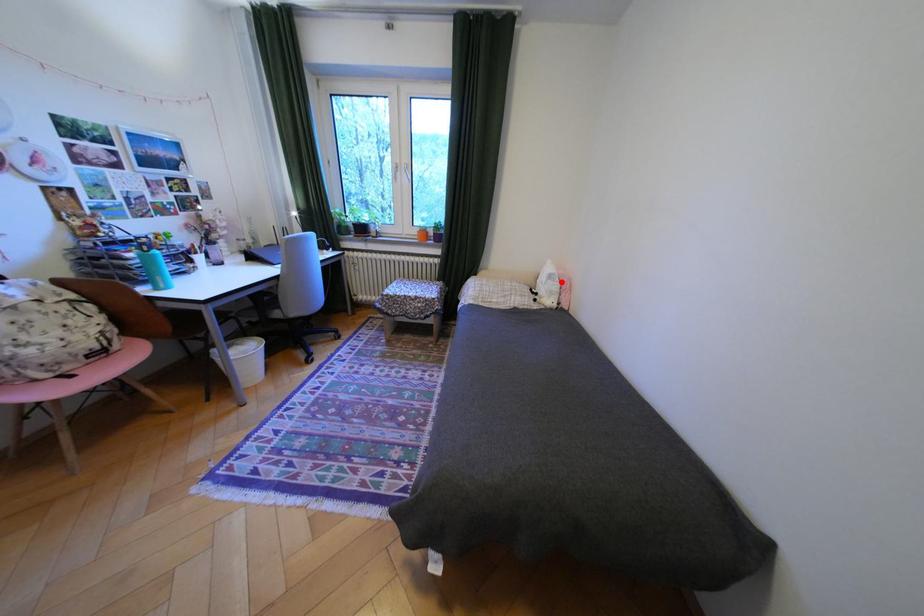
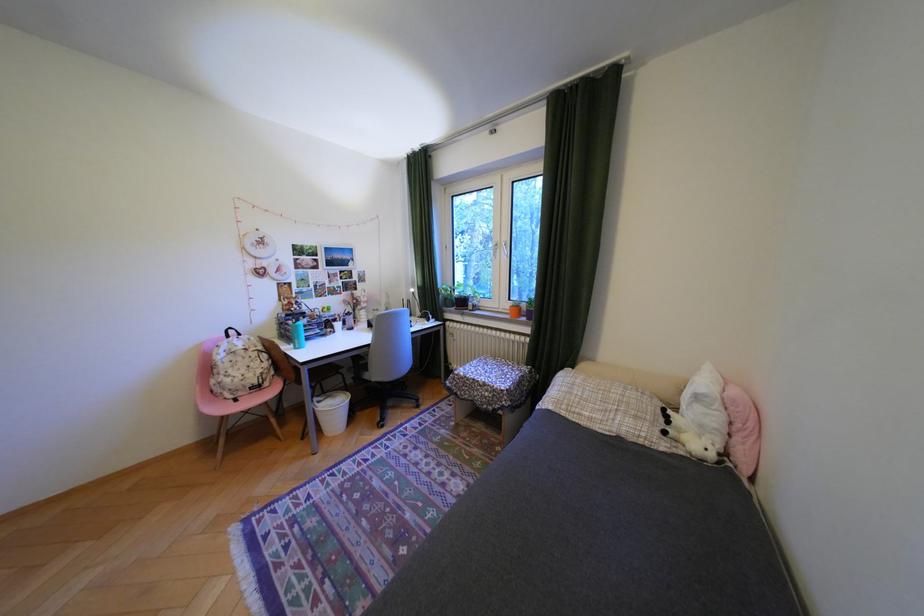
Question: I am providing you with two images of the same scene from different viewpoints. Given a red point in image1, look at the same physical point in image2. Is it:

Choices:
 (A) Closer to the viewpoint
 (B) Farther from the viewpoint

Answer: (B)